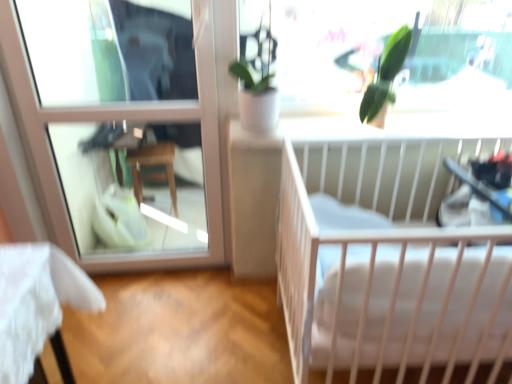
Question: Looking at their shapes, would you say clear glass window at upper left is wider or thinner than white soft mattress at center?

Choices:
 (A) thin
 (B) wide

Answer: (B)

Question: In the image, is clear glass window at upper left positioned in front of or behind white soft mattress at center?

Choices:
 (A) front
 (B) behind

Answer: (B)

Question: Estimate the real-world distances between objects in this image. Which object is farther from the clear glass window at upper left?

Choices:
 (A) white soft mattress at center
 (B) green leafy plant at upper center
 (C) white matte crib at right
 (D) black plastic baby carriage at right

Answer: (D)

Question: Which object is positioned closest to the clear glass window at upper left?

Choices:
 (A) black plastic baby carriage at right
 (B) white soft mattress at center
 (C) white matte crib at right
 (D) green leafy plant at upper center

Answer: (D)